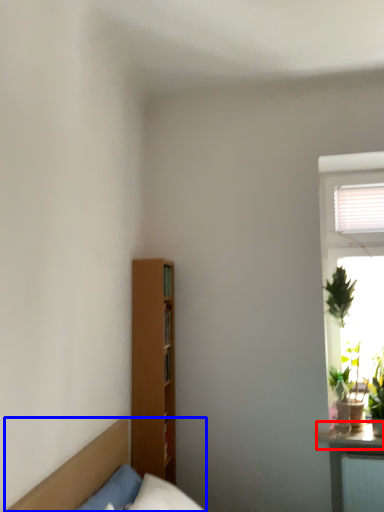
Question: Which object appears farthest to the camera in this image, window sill (highlighted by a red box) or furniture (highlighted by a blue box)?

Choices:
 (A) window sill
 (B) furniture

Answer: (A)